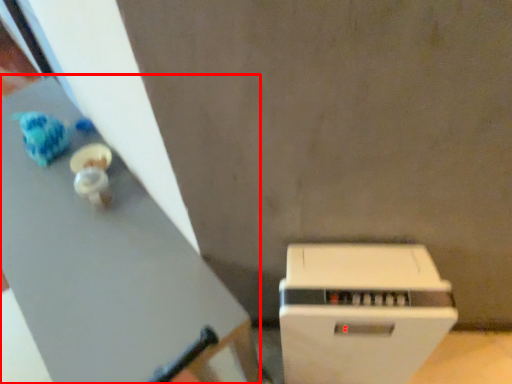
Question: From the image's perspective, considering the relative positions of table (annotated by the red box) and home appliance in the image provided, where is table (annotated by the red box) located with respect to the staircase?

Choices:
 (A) above
 (B) below

Answer: (A)